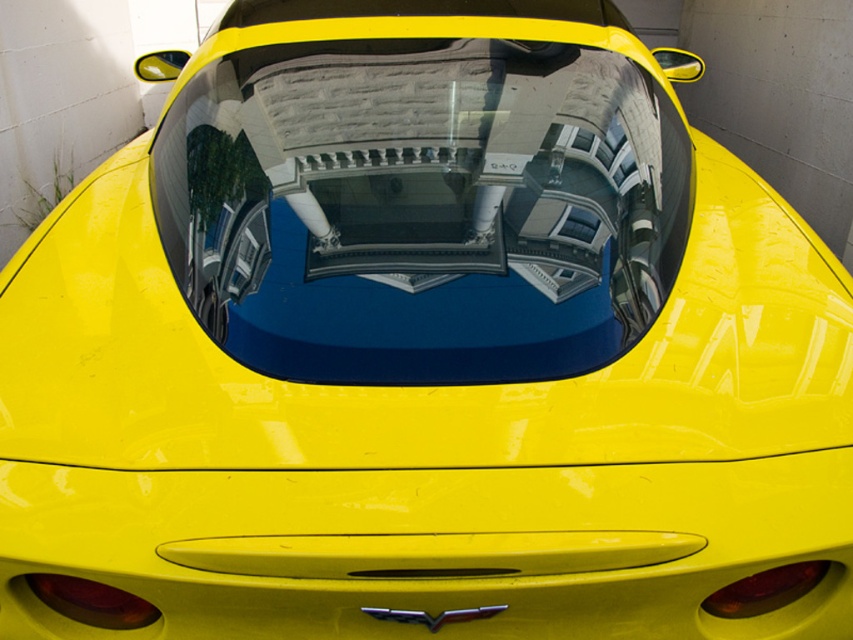
You are a photographer trying to capture the Chevrolet logo on the rear of the bright yellow sports car. You notice the transparent glass windshield at center and the white plastic license plate at center. Which object is wider?

The transparent glass windshield at center is wider than the white plastic license plate at center.

You are a car designer who wants to install a new sensor between the transparent glass windshield at center and the white plastic license plate at center. The sensor requires 50 centimeters of space. Can the sensor be placed there?

The distance between the transparent glass windshield at center and the white plastic license plate at center is 48.93 centimeters, which is less than the required 50 centimeters. Therefore, the sensor cannot be placed there.

You are standing in front of a Chevrolet sports car and want to touch the point at coordinates point (244, 131). If your arm can reach 7 feet, can you reach it?

The point (244, 131) is 8.10 feet away from the viewer, so your arm cannot reach it since it is longer than 7 feet.